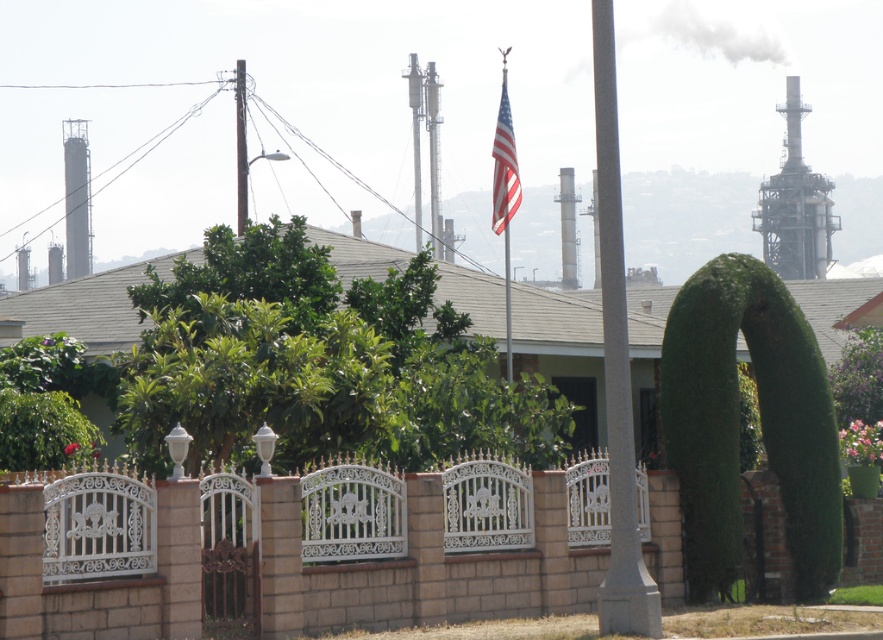
Question: Estimate the real-world distances between objects in this image. Which object is closer to the metallic streetlight at upper center?

Choices:
 (A) metallic silver flag pole at center
 (B) american flag at center

Answer: (B)

Question: Which of the following is the farthest from the observer?

Choices:
 (A) green leafy hedge at center
 (B) gray concrete pole at center
 (C) american flag at center
 (D) white wrought iron fence at center

Answer: (C)

Question: Can you confirm if green leafy hedge at center is positioned above metallic streetlight at upper center?

Choices:
 (A) no
 (B) yes

Answer: (A)

Question: Is green leafy hedge at center wider than metallic silver flag pole at center?

Choices:
 (A) yes
 (B) no

Answer: (B)

Question: Which object appears closest to the camera in this image?

Choices:
 (A) gray concrete pole at center
 (B) american flag at center

Answer: (A)

Question: Is the position of american flag at center less distant than that of metallic pole at upper center?

Choices:
 (A) no
 (B) yes

Answer: (B)